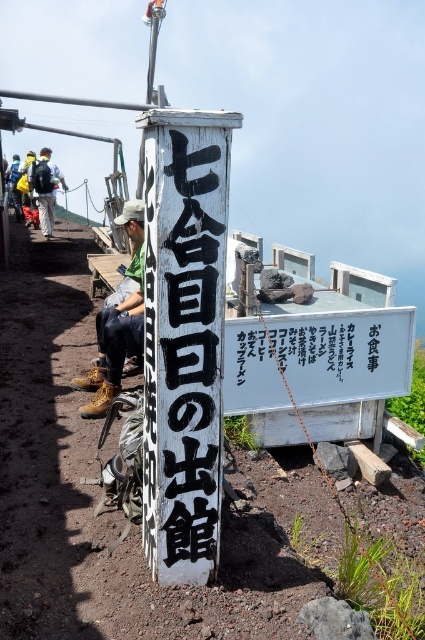
Who is higher up, black paper sign at center or brown leather boots at center?

brown leather boots at center is higher up.

Does black paper sign at center lie behind brown leather boots at center?

Yes, black paper sign at center is further from the viewer.

Does point (229, 333) come behind point (104, 412)?

No, (229, 333) is closer to viewer.

Where is `black paper sign at center`? black paper sign at center is located at coordinates (325, 349).

Is point (217, 401) closer to viewer compared to point (42, 182)?

Yes, point (217, 401) is in front of point (42, 182).

Between point (189, 504) and point (44, 224), which one is positioned behind?

The point (44, 224) is behind.

This screenshot has height=640, width=425. Find the location of `black painted wood sign at center`. black painted wood sign at center is located at coordinates (189, 352).

In the scene shown: Can you confirm if black painted wood sign at center is taller than black paper sign at center?

Yes, black painted wood sign at center is taller than black paper sign at center.

Is black painted wood sign at center smaller than black paper sign at center?

Yes.

Locate an element on the screen. black painted wood sign at center is located at coordinates (189, 352).

Find the location of `black painted wood sign at center`. black painted wood sign at center is located at coordinates (189, 352).